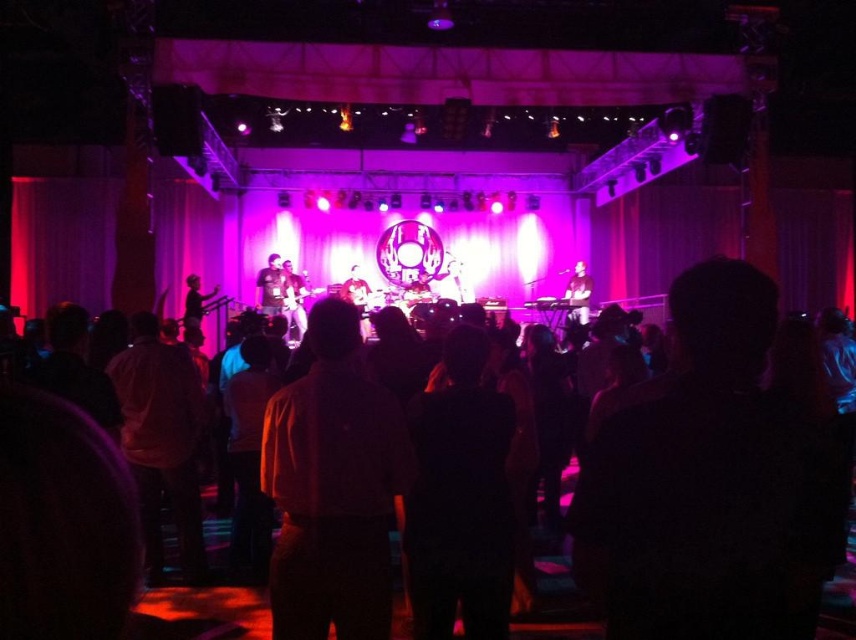
Question: Can you confirm if orange shirt at center is positioned below dark brown shirt at center?

Choices:
 (A) yes
 (B) no

Answer: (B)

Question: Does orange shirt at center have a greater width compared to dark brown shirt at center?

Choices:
 (A) yes
 (B) no

Answer: (A)

Question: Which point is farther to the camera?

Choices:
 (A) dark brown shirt at center
 (B) orange shirt at center

Answer: (A)

Question: Which point appears closest to the camera in this image?

Choices:
 (A) (849, 620)
 (B) (376, 465)

Answer: (B)

Question: Is orange shirt at center below dark brown shirt at center?

Choices:
 (A) yes
 (B) no

Answer: (B)